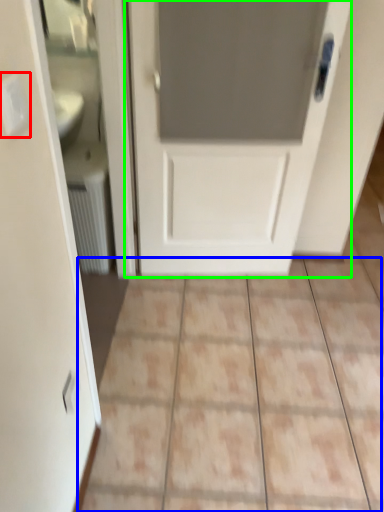
Question: Based on their relative distances, which object is farther from electric outlet (highlighted by a red box)? Choose from ceramic tile (highlighted by a blue box) and door (highlighted by a green box).

Choices:
 (A) ceramic tile
 (B) door

Answer: (A)